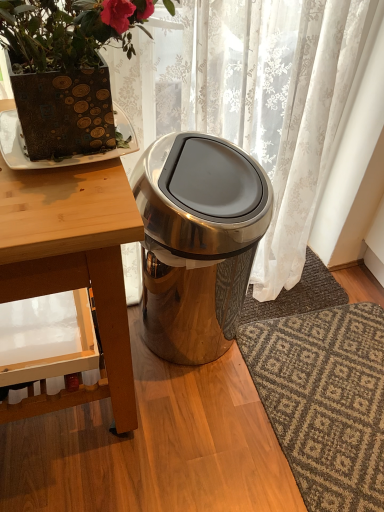
Where is `free point to the right of wooden table at left`? This screenshot has width=384, height=512. free point to the right of wooden table at left is located at coordinates (216, 426).